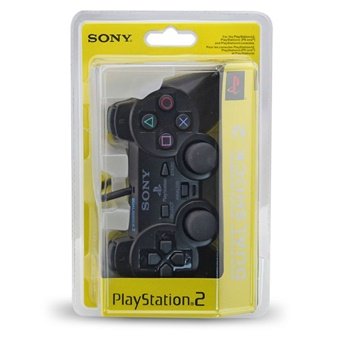
Identify the location of circular remote control buttons like joystick. (200, 229), (199, 155).